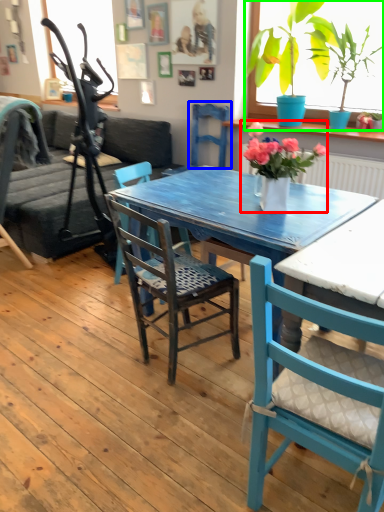
Question: Which object is positioned closest to houseplant (highlighted by a red box)? Select from armchair (highlighted by a blue box) and houseplant (highlighted by a green box).

Choices:
 (A) armchair
 (B) houseplant

Answer: (B)